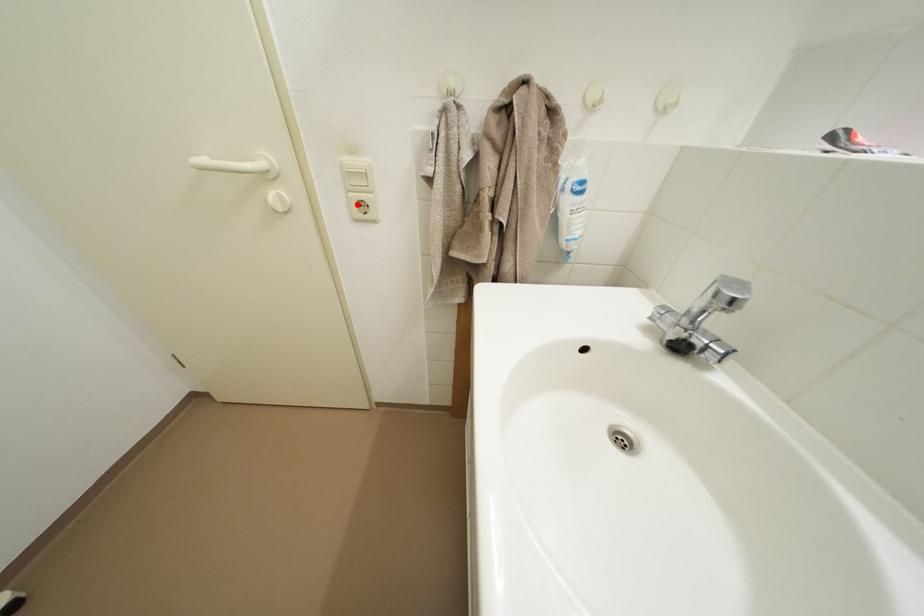
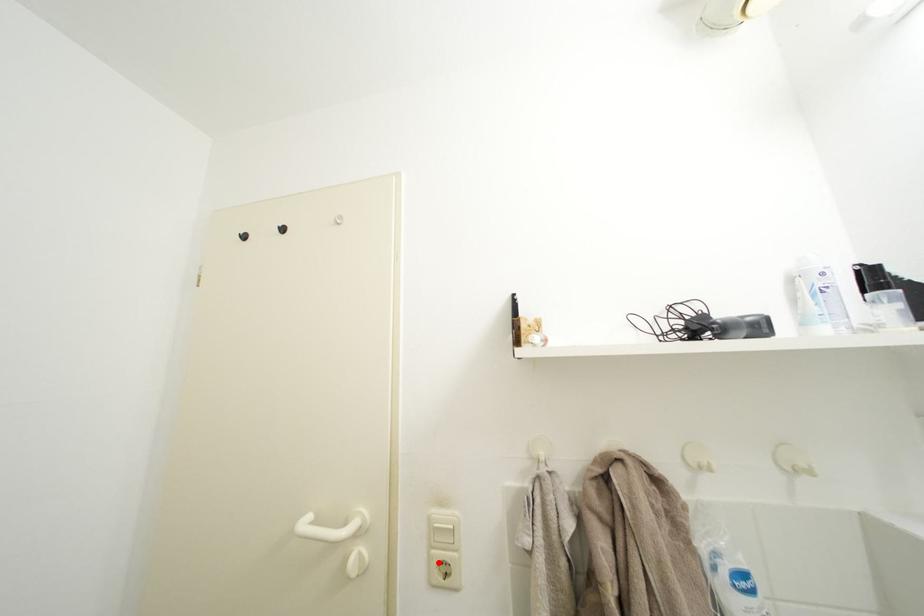
I am providing you with two images of the same scene from different viewpoints. A red point is marked on the first image and another point is marked on the second image. Are the points marked in image1 and image2 representing the same 3D position?

Yes